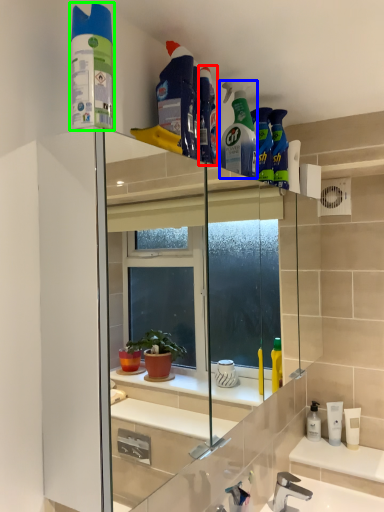
Question: Considering the real-world distances, which object is closest to cleaning product (highlighted by a red box)? cleaning product (highlighted by a blue box) or cleaning product (highlighted by a green box).

Choices:
 (A) cleaning product
 (B) cleaning product

Answer: (A)